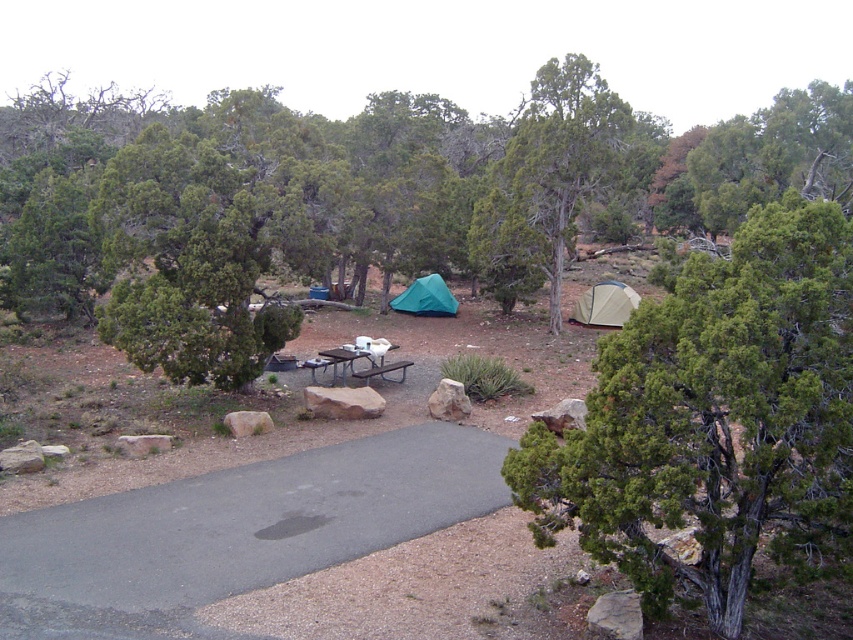
Question: Does green fabric tent at center come behind brown wooden picnic table at center?

Choices:
 (A) no
 (B) yes

Answer: (B)

Question: Does green textured tent at upper center appear on the left side of brown metal picnic table at center?

Choices:
 (A) yes
 (B) no

Answer: (B)

Question: Which point is farther to the camera?

Choices:
 (A) (447, 310)
 (B) (833, 330)

Answer: (A)

Question: Does green leafy tree at center have a larger size compared to green textured tent at upper center?

Choices:
 (A) yes
 (B) no

Answer: (A)

Question: Among these objects, which one is farthest from the camera?

Choices:
 (A) beige canvas tent at center-right
 (B) green fabric tent at center
 (C) brown wooden picnic table at center
 (D) green textured tent at upper center

Answer: (B)

Question: Which of the following is the farthest from the observer?

Choices:
 (A) green leafy tree at center
 (B) brown wooden picnic table at center
 (C) green textured tent at upper center
 (D) beige canvas tent at center-right

Answer: (D)